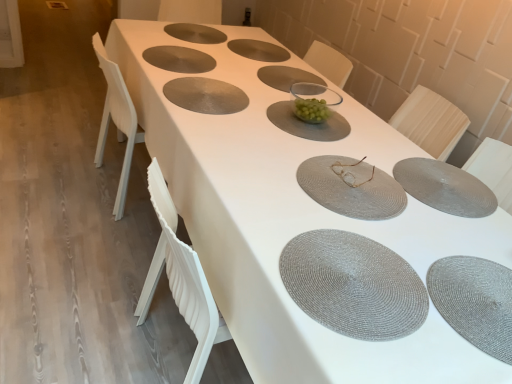
This screenshot has width=512, height=384. I want to click on unoccupied region to the right of green glass bowl at center, positioned as the 5th tableware in top-to-bottom order, so (x=382, y=144).